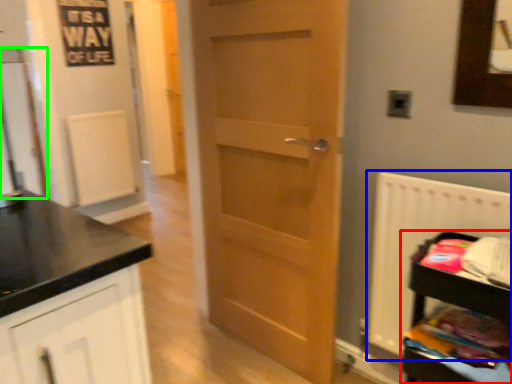
Question: Which object is positioned farthest from shelf (highlighted by a red box)? Select from radiator (highlighted by a blue box) and glass door (highlighted by a green box).

Choices:
 (A) radiator
 (B) glass door

Answer: (B)